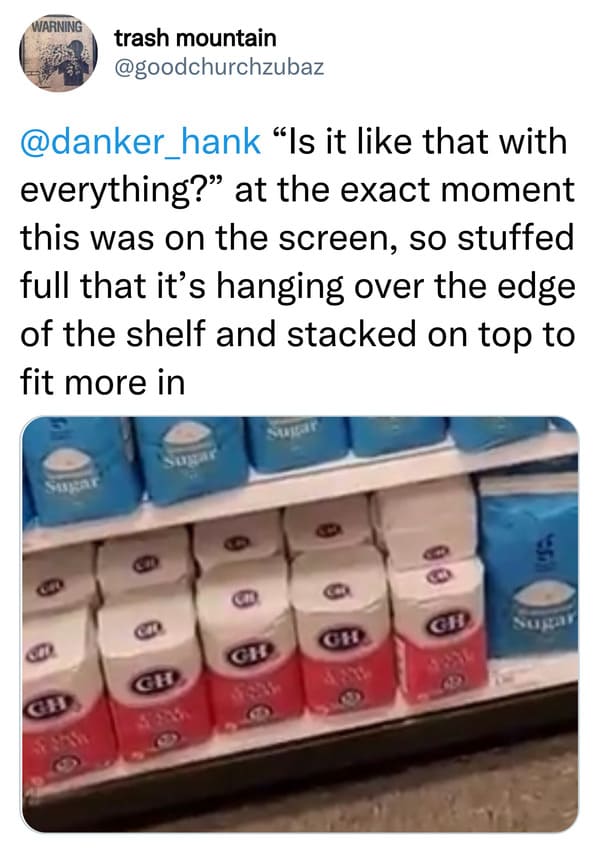
Where is `white shelf`? This screenshot has height=855, width=599. white shelf is located at coordinates (371, 475).